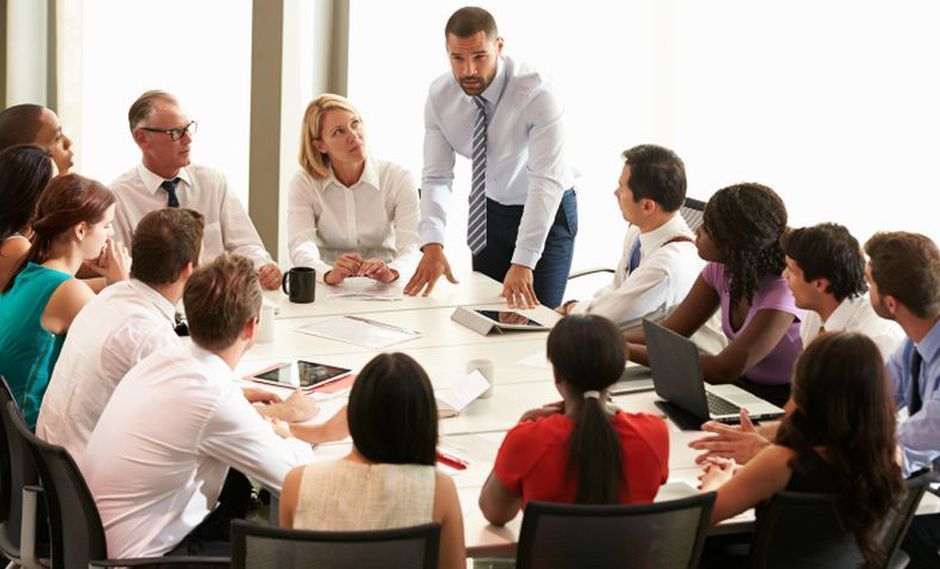
This screenshot has height=569, width=940. What are the coordinates of `chairs` in the screenshot? It's located at (911, 490), (667, 526), (403, 546), (70, 526), (692, 208).